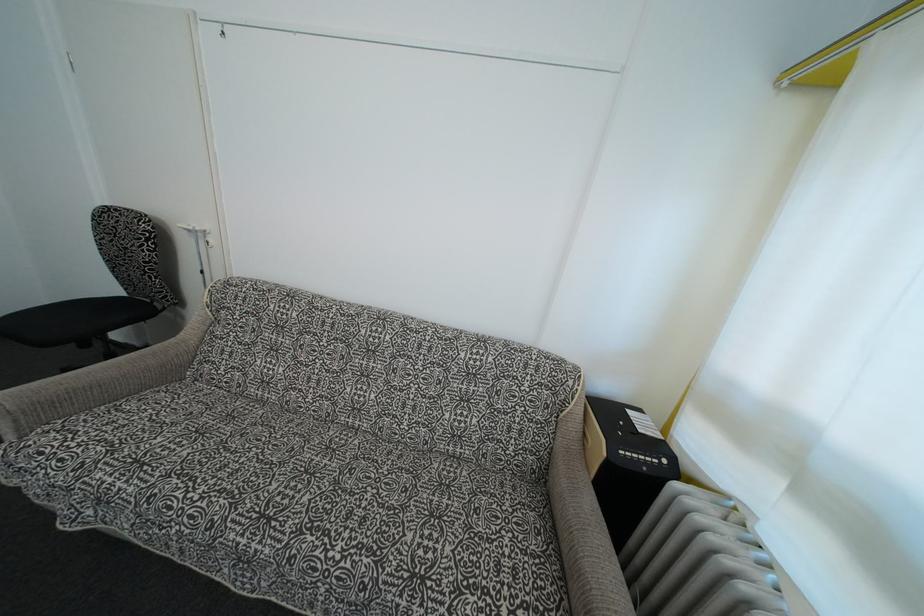
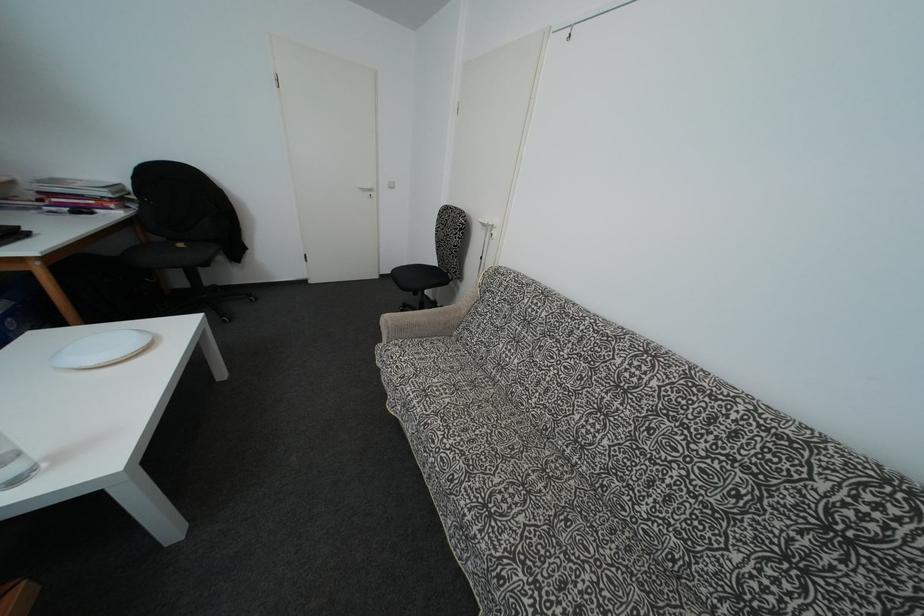
Question: The camera is either moving clockwise (left) or counter-clockwise (right) around the object. The first image is from the beginning of the video and the second image is from the end. Is the camera moving left or right when shooting the video?

Choices:
 (A) Left
 (B) Right

Answer: (B)